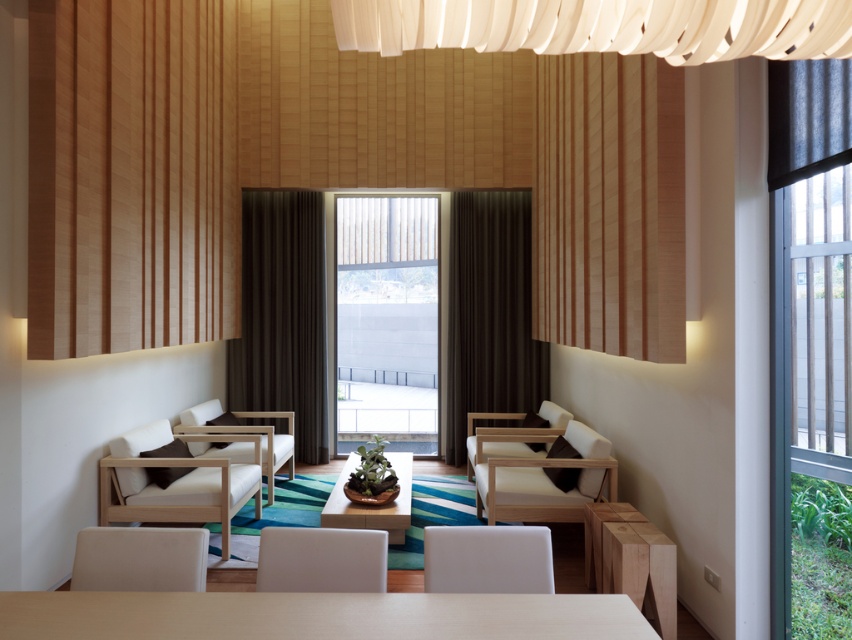
You are a guest entering the room and want to place a small gift on the wooden bowl at center without moving the dark brown fabric curtain at left. Is this possible?

The dark brown fabric curtain at left is positioned over the wooden bowl at center, so you cannot place the gift on the wooden bowl at center without moving the curtain first.

You are standing in the middle of the room and want to walk to the wooden bowl at center. Which direction should you walk to avoid the dark brown fabric curtain at left?

Since the dark brown fabric curtain at left is to the left of wooden bowl at center, you should walk towards the right direction to reach the wooden bowl at center while avoiding the curtain.

You are standing at the entrance of the lounge and want to place a 2.5 meter long sofa between the wooden paneling at left and the light wood table at lower center. Is there enough space?

The wooden paneling at left is 4.71 meters away from the light wood table at lower center, so yes, there is enough space to place a 2.5 meter long sofa between them since the distance is greater than the sofa length.